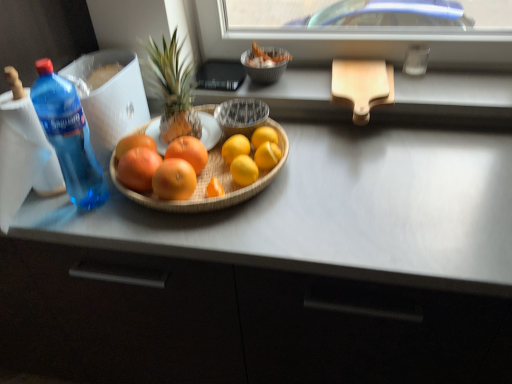
Locate an element on the screen. vacant space to the right of orange matte grapefruit at center, marked as the second grapefruit in a right-to-left arrangement is located at coordinates (267, 185).